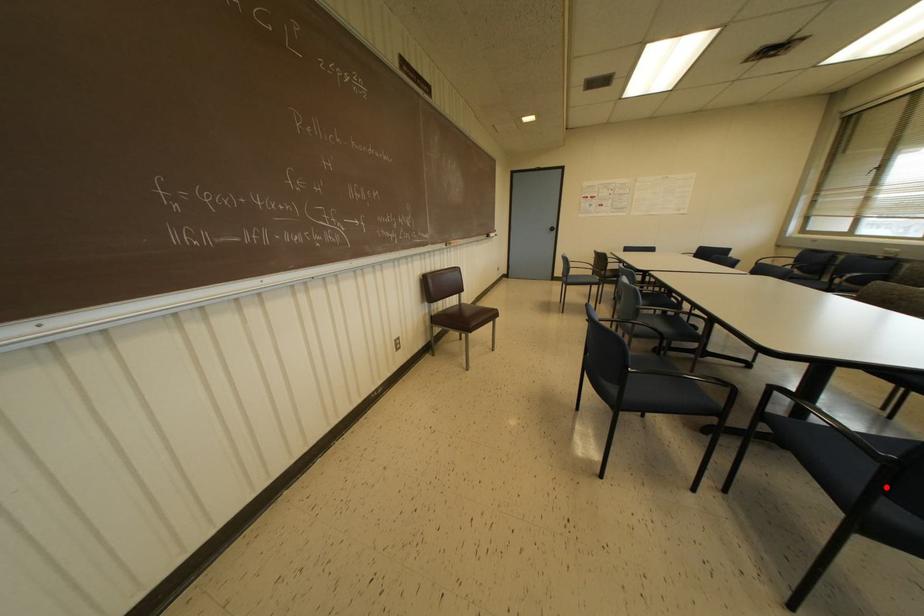
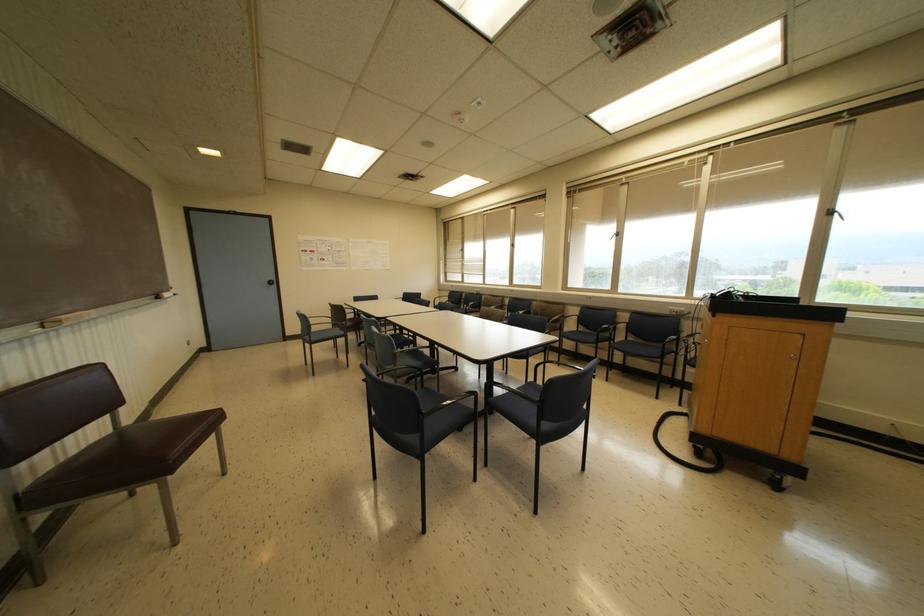
Locate, in the second image, the point that corresponds to the highlighted location in the first image.

(540, 415)